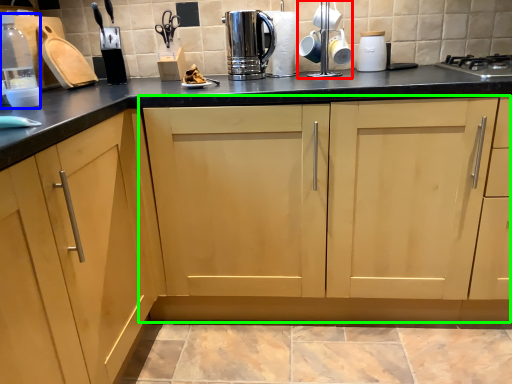
Question: Based on their relative distances, which object is nearer to appliance (highlighted by a red box)? Choose from bottle (highlighted by a blue box) and cabinetry (highlighted by a green box).

Choices:
 (A) bottle
 (B) cabinetry

Answer: (B)